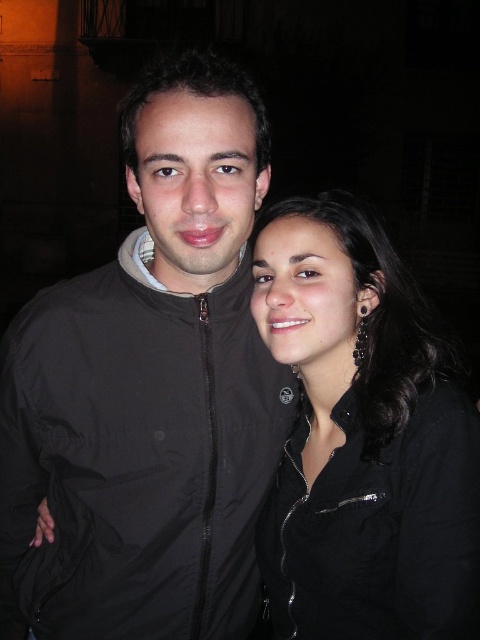
You are a photographer setting up for a night shoot in an urban area. You need to ensure that the black matte jacket at center and the black matte shirt at right are both visible in your frame. Given that the jacket is larger than the shirt, which object should you focus on to ensure both are in focus?

The black matte jacket at center is larger than the black matte shirt at right, so focusing on the jacket will help ensure both objects are in focus since it occupies more space in the frame.

You are taking a photo of two people in a nighttime setting. You want to ensure that the point at coordinates point (203, 464) is in focus. What is the minimum distance you should set your camera lens to focus on to capture this point clearly?

The point (203, 464) is 6.03 feet from the camera, so you should set your camera lens to focus at least 6.03 feet away to ensure it is in focus.

You are a photographer trying to focus on the black matte jacket at center in the image. The camera shows a point at coordinates [151,388]. Is this point likely the center of the black matte jacket at center?

Yes, the point [151,388] marks the center of the black matte jacket at center as stated in the description.